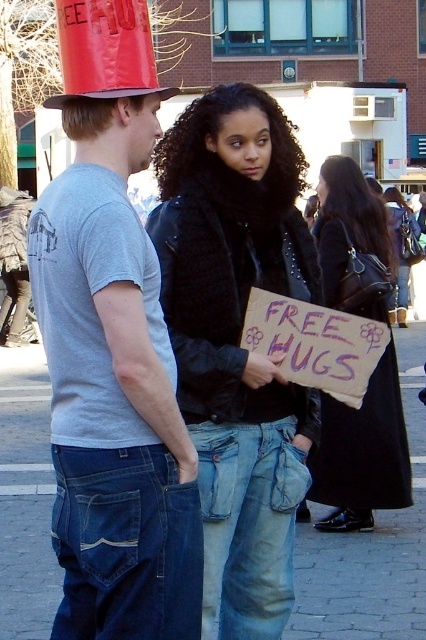
Between point (317, 582) and point (132, 52), which one is positioned behind?

Positioned behind is point (317, 582).

Is point (25, 532) behind point (111, 8)?

Yes, it is.

I want to click on blue jeans at center, so point(371,547).

Can you confirm if matte gray t-shirt at left is smaller than shiny red paper hat at upper left?

Actually, matte gray t-shirt at left might be larger than shiny red paper hat at upper left.

Between matte gray t-shirt at left and shiny red paper hat at upper left, which one is positioned higher?

shiny red paper hat at upper left is above.

Between point (62, 38) and point (89, 52), which one is positioned behind?

The point (62, 38) is more distant.

Where is `matte gray t-shirt at left`? This screenshot has height=640, width=426. matte gray t-shirt at left is located at coordinates tap(112, 349).

Does leather jacket at center have a larger size compared to black leather coat at center?

Indeed, leather jacket at center has a larger size compared to black leather coat at center.

Which is in front, point (293, 173) or point (356, 477)?

Positioned in front is point (293, 173).

I want to click on leather jacket at center, so click(236, 340).